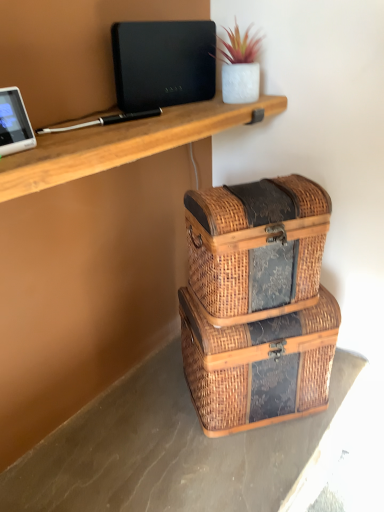
Question: Which is correct: brown wicker baskets at lower right is inside black matte laptop at upper center, or outside of it?

Choices:
 (A) outside
 (B) inside

Answer: (A)

Question: From a real-world perspective, relative to black matte laptop at upper center, is brown wicker baskets at lower right vertically above or below?

Choices:
 (A) above
 (B) below

Answer: (B)

Question: Based on their relative distances, which object is nearer to the woven wood storage box at lower center, the 2th storage box positioned from the top?

Choices:
 (A) black matte laptop at upper center
 (B) brown wicker baskets at lower right
 (C) woven wood trunk at center, arranged as the second storage box when ordered from the bottom
 (D) white glossy tablet at upper left

Answer: (C)

Question: Which object is positioned farthest from the woven wood storage box at lower center, the 2th storage box positioned from the top?

Choices:
 (A) brown wicker baskets at lower right
 (B) white glossy tablet at upper left
 (C) black matte laptop at upper center
 (D) woven wood trunk at center, the first storage box in the top-to-bottom sequence

Answer: (B)